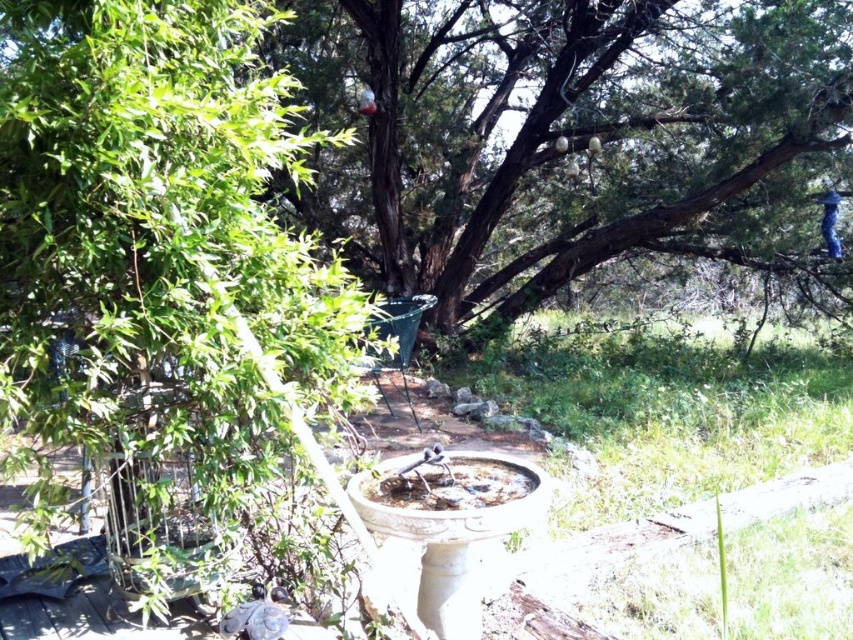
Question: Is white ceramic bird bath at center to the left of smooth gray bird at lower left from the viewer's perspective?

Choices:
 (A) yes
 (B) no

Answer: (B)

Question: In this image, where is green textured tree at center located relative to white ceramic bird bath at center?

Choices:
 (A) below
 (B) above

Answer: (B)

Question: Is green leafy tree at upper left below smooth gray bird at lower left?

Choices:
 (A) no
 (B) yes

Answer: (A)

Question: Among these points, which one is farthest from the camera?

Choices:
 (A) (490, 580)
 (B) (270, 632)
 (C) (167, 60)

Answer: (A)

Question: Among these points, which one is farthest from the camera?

Choices:
 (A) (483, 570)
 (B) (825, 8)
 (C) (277, 444)

Answer: (B)

Question: Which object appears closest to the camera in this image?

Choices:
 (A) blue matte parrot at upper right
 (B) white ceramic bird bath at center
 (C) green leafy tree at upper left

Answer: (C)